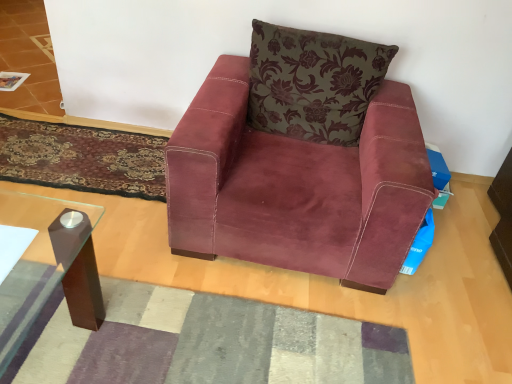
Question: Is textured gray mat at center, acting as the 2th mat starting from the back, closer to the viewer compared to velvet floral pillow at center?

Choices:
 (A) yes
 (B) no

Answer: (A)

Question: Is textured gray mat at center, the second mat when ordered from top to bottom, thinner than velvet floral pillow at center?

Choices:
 (A) no
 (B) yes

Answer: (A)

Question: Is textured gray mat at center, which appears as the 1th mat when viewed from the front, positioned beyond the bounds of velvet floral pillow at center?

Choices:
 (A) no
 (B) yes

Answer: (B)

Question: Can you confirm if textured gray mat at center, which appears as the 1th mat when viewed from the front, is shorter than velvet floral pillow at center?

Choices:
 (A) no
 (B) yes

Answer: (B)

Question: From the image's perspective, is textured gray mat at center, acting as the 2th mat starting from the back, below velvet floral pillow at center?

Choices:
 (A) yes
 (B) no

Answer: (A)

Question: Is textured gray mat at center, the second mat when ordered from top to bottom, directly adjacent to velvet floral pillow at center?

Choices:
 (A) no
 (B) yes

Answer: (A)

Question: Is velvet-like burgundy mat at lower left, which appears as the second mat when viewed from the front, thinner than velvet floral pillow at center?

Choices:
 (A) no
 (B) yes

Answer: (A)

Question: Does velvet-like burgundy mat at lower left, placed as the 1th mat when sorted from top to bottom, have a larger size compared to velvet floral pillow at center?

Choices:
 (A) yes
 (B) no

Answer: (B)

Question: Can you confirm if velvet-like burgundy mat at lower left, which ranks as the second mat in bottom-to-top order, is smaller than velvet floral pillow at center?

Choices:
 (A) no
 (B) yes

Answer: (B)

Question: Is velvet floral pillow at center inside velvet-like burgundy mat at lower left, which ranks as the second mat in bottom-to-top order?

Choices:
 (A) no
 (B) yes

Answer: (A)

Question: Is velvet-like burgundy mat at lower left, the 1th mat in the back-to-front sequence, positioned in front of velvet floral pillow at center?

Choices:
 (A) no
 (B) yes

Answer: (A)

Question: Does velvet-like burgundy mat at lower left, the 1th mat in the back-to-front sequence, appear on the left side of velvet floral pillow at center?

Choices:
 (A) no
 (B) yes

Answer: (B)

Question: Could you tell me if suede-like burgundy armchair at center is turned towards velvet floral pillow at center?

Choices:
 (A) no
 (B) yes

Answer: (A)